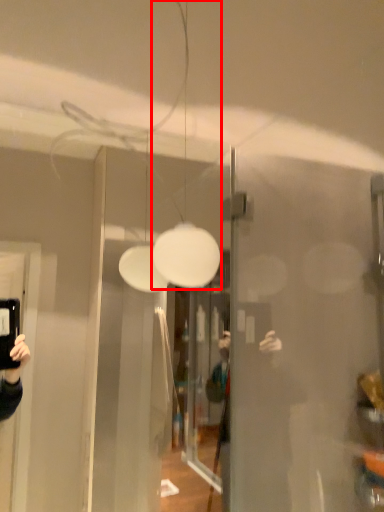
Question: Considering the relative positions of light fixture (annotated by the red box) and glass door in the image provided, where is light fixture (annotated by the red box) located with respect to the staircase?

Choices:
 (A) left
 (B) right

Answer: (B)